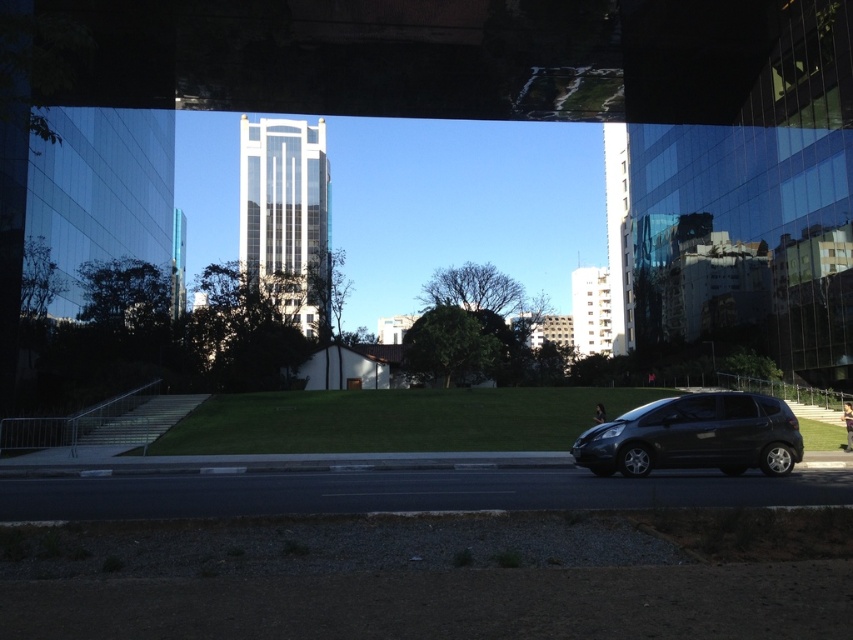
You are a delivery driver who needs to park your shiny black hatchback at center in a parking spot that can only accommodate vehicles smaller than the clear glass tower at center. Can your car fit?

The clear glass tower at center is bigger than the shiny black hatchback at center, so the parking spot can accommodate the shiny black hatchback at center since it is smaller than the tower.

You are a delivery driver who needs to park your shiny black hatchback at center. There is a clear glass tower at center nearby. To avoid blocking the entrance of the tower, which side should you park your car relative to the tower?

The clear glass tower at center is positioned on the left side of the shiny black hatchback at center, so to avoid blocking the entrance, you should park the shiny black hatchback at center to the right side of the tower.

Based on the scene description, where is the clear glass tower at center located in terms of coordinates?

The clear glass tower at center is located at coordinates point (x=285, y=209).